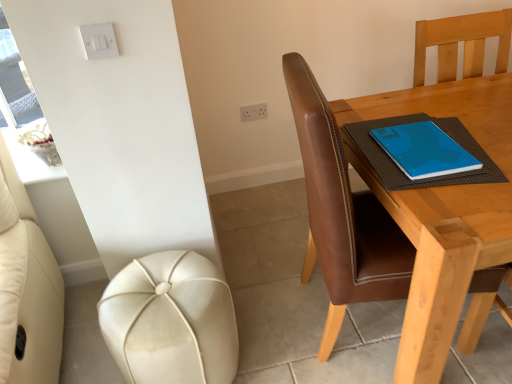
Locate an element on the screen. vacant area situated to the left side of brown leather chair at right is located at coordinates (266, 304).